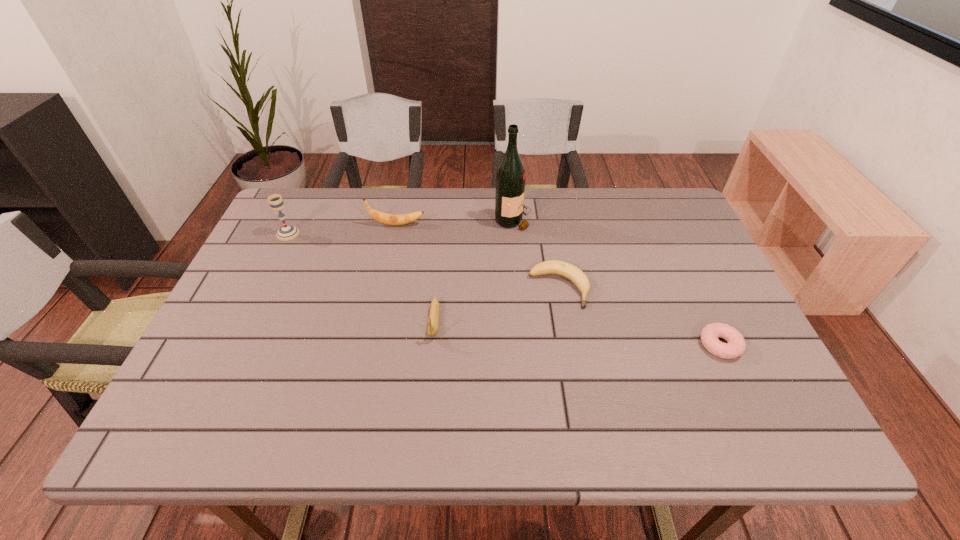
At what (x,y) coordinates should I click in order to perform the action: click on the second closest banana to the rightmost banana. Please return your answer as a coordinate pair (x, y). The height and width of the screenshot is (540, 960). Looking at the image, I should click on (389, 219).

Identify the location of free space that satisfies the following two spatial constraints: 1. on the peel of the farthest banana from the top; 2. on the right side of the rightmost banana. (383, 288).

Where is `free space in the image that satisfies the following two spatial constraints: 1. on the back side of the rightmost banana; 2. on the peel of the leftmost banana from the top`? This screenshot has height=540, width=960. free space in the image that satisfies the following two spatial constraints: 1. on the back side of the rightmost banana; 2. on the peel of the leftmost banana from the top is located at coordinates (547, 224).

At what (x,y) coordinates should I click in order to perform the action: click on vacant space that satisfies the following two spatial constraints: 1. on the peel of the leftmost banana from the top; 2. on the right side of the doughnut. Please return your answer as a coordinate pair (x, y). This screenshot has height=540, width=960. Looking at the image, I should click on (371, 345).

Locate an element on the screen. The width and height of the screenshot is (960, 540). vacant space that satisfies the following two spatial constraints: 1. on the back side of the shortest banana; 2. on the peel of the farthest banana from the top is located at coordinates (547, 224).

Identify the location of free location that satisfies the following two spatial constraints: 1. on the peel of the fourth shortest object from the top; 2. on the left side of the doughnut. pyautogui.click(x=371, y=345).

Identify the location of free spot that satisfies the following two spatial constraints: 1. on the front side of the fifth shortest object; 2. on the left side of the rightmost object. The width and height of the screenshot is (960, 540). (234, 345).

The width and height of the screenshot is (960, 540). Find the location of `free location that satisfies the following two spatial constraints: 1. on the peel of the farthest banana from the top; 2. on the right side of the shortest banana`. free location that satisfies the following two spatial constraints: 1. on the peel of the farthest banana from the top; 2. on the right side of the shortest banana is located at coordinates (383, 288).

Find the location of a particular element. The height and width of the screenshot is (540, 960). free space that satisfies the following two spatial constraints: 1. on the front side of the leftmost object; 2. on the right side of the rightmost object is located at coordinates (234, 345).

Locate an element on the screen. This screenshot has height=540, width=960. free region that satisfies the following two spatial constraints: 1. on the peel of the farthest banana from the top; 2. on the left side of the shortest object is located at coordinates (371, 345).